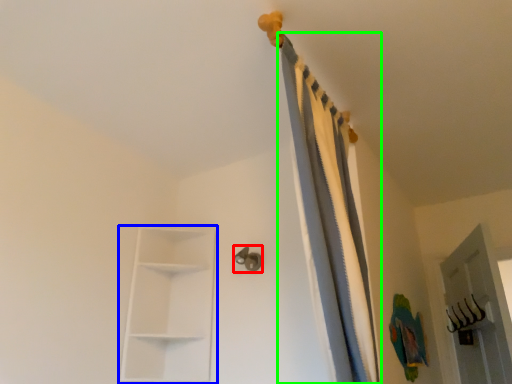
Question: Which object is the farthest from door handle (highlighted by a red box)? Choose among these: shelf (highlighted by a blue box) or curtain (highlighted by a green box).

Choices:
 (A) shelf
 (B) curtain

Answer: (B)